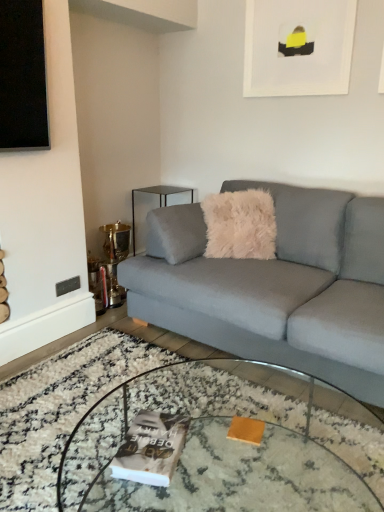
Question: Does point (x=223, y=494) appear closer or farther from the camera than point (x=268, y=94)?

Choices:
 (A) closer
 (B) farther

Answer: (A)

Question: Is clear glass coffee table at center in front of or behind white matte picture frame at upper center in the image?

Choices:
 (A) behind
 (B) front

Answer: (B)

Question: Which object is positioned farthest from the white matte picture frame at upper center?

Choices:
 (A) clear glass coffee table at center
 (B) fuzzy beige pillow at center
 (C) light gray fabric couch at center
 (D) matte gray magazine at center
 (E) clear glass side table at upper left

Answer: (D)

Question: Considering the real-world distances, which object is closest to the clear glass side table at upper left?

Choices:
 (A) matte gray magazine at center
 (B) fuzzy beige pillow at center
 (C) clear glass coffee table at center
 (D) white matte picture frame at upper center
 (E) light gray fabric couch at center

Answer: (B)